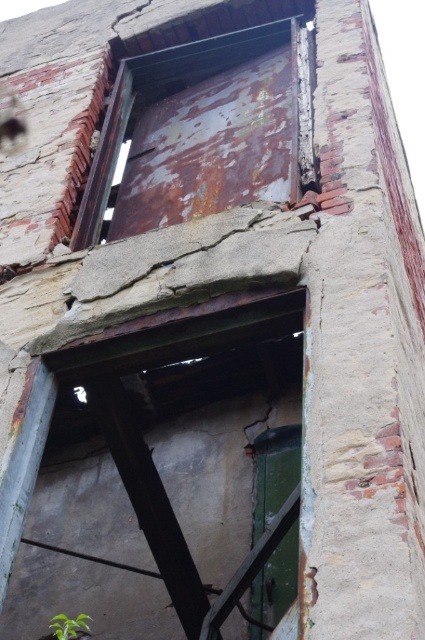
Can you confirm if rusty metal door at center is wider than rusty metal door at upper center?

Yes, rusty metal door at center is wider than rusty metal door at upper center.

Can you confirm if rusty metal door at center is positioned to the right of rusty metal door at upper center?

Indeed, rusty metal door at center is positioned on the right side of rusty metal door at upper center.

The width and height of the screenshot is (425, 640). Describe the element at coordinates (167, 477) in the screenshot. I see `rusty metal door at center` at that location.

Image resolution: width=425 pixels, height=640 pixels. Find the location of `rusty metal door at center`. rusty metal door at center is located at coordinates (167, 477).